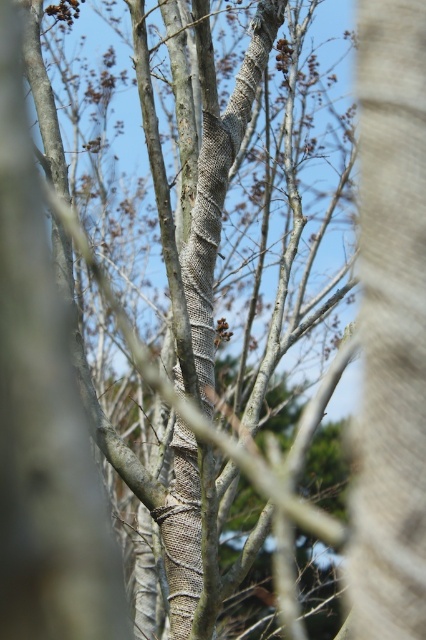
You are standing in front of a tree with a wrapped trunk. There is a point marked at coordinates (391, 324). What does this point indicate?

The point at (391, 324) indicates the location of the smooth bark tree trunk at center.